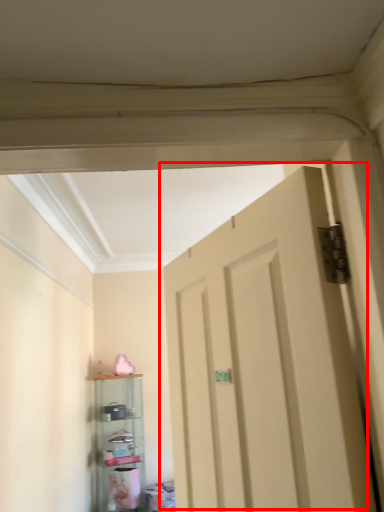
Question: From the image's perspective, where is door (annotated by the red box) located relative to shelf?

Choices:
 (A) below
 (B) above

Answer: (B)